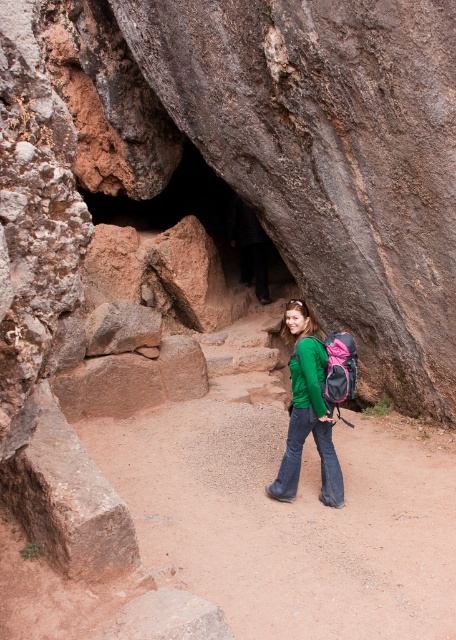
You are planning to take a photo of the person wearing both the green matte shirt at center and the green matte sweatshirt at center. Since they are both at the same position, how can you ensure both items are visible in the photo?

The green matte sweatshirt at center is behind the green matte shirt at center, so you can adjust the camera angle or have the person move slightly to ensure both items are visible without one blocking the other.

You are a hiker who wants to take a photo of the rock formation with your friend wearing a green matte shirt at center and green matte sweatshirt at center. Can you fit both of them in the photo if your camera has a 5 inch wide field of view?

The distance between the green matte shirt at center and the green matte sweatshirt at center is 4.30 inches. Since the camera has a 5 inch wide field of view, both can be captured as the distance is less than 5 inches.